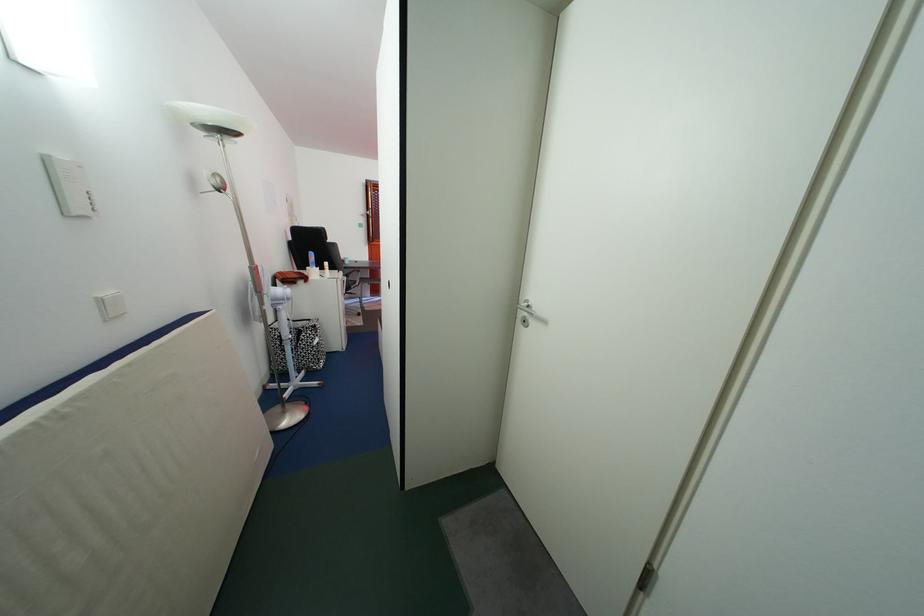
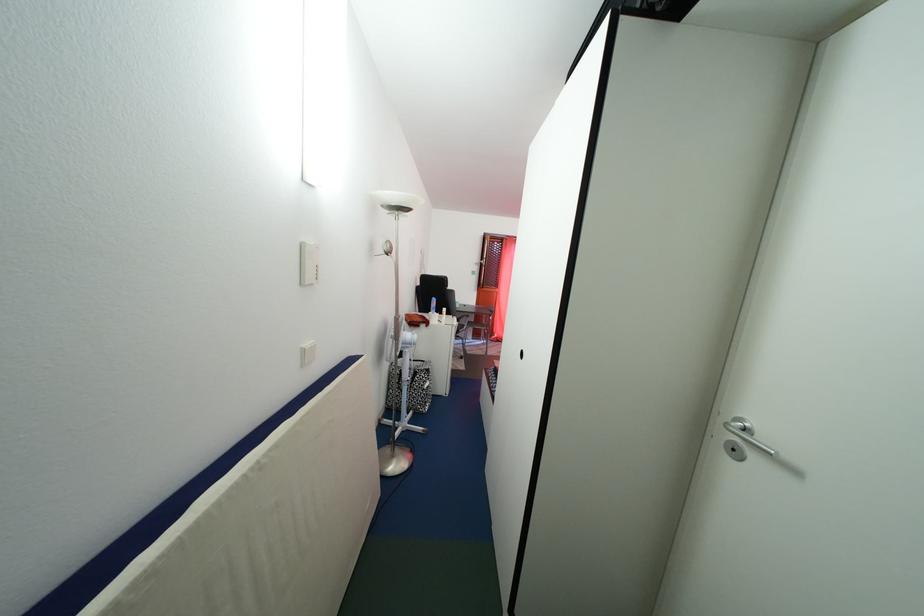
Find the pixel in the second image that matches pixel 356 269 in the first image.

(466, 313)